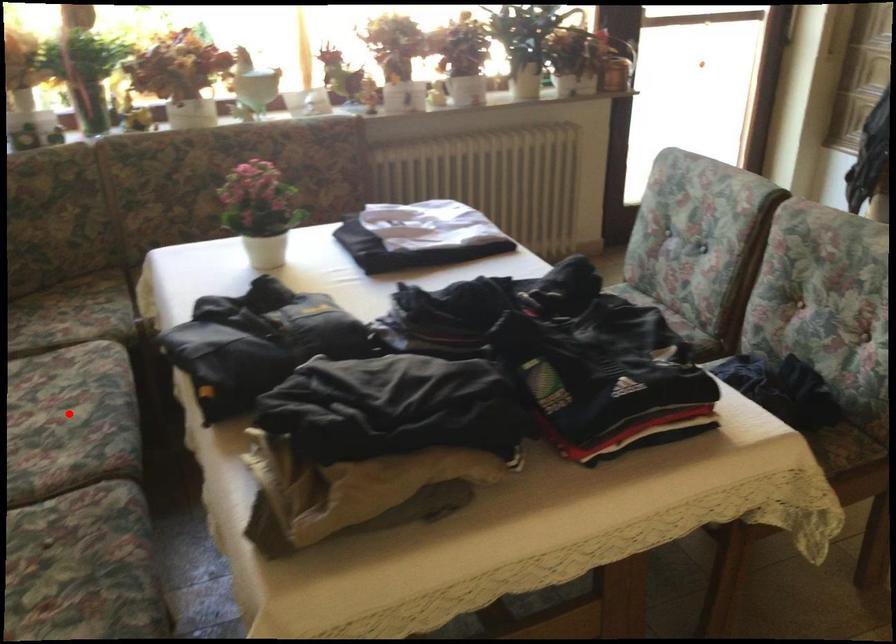
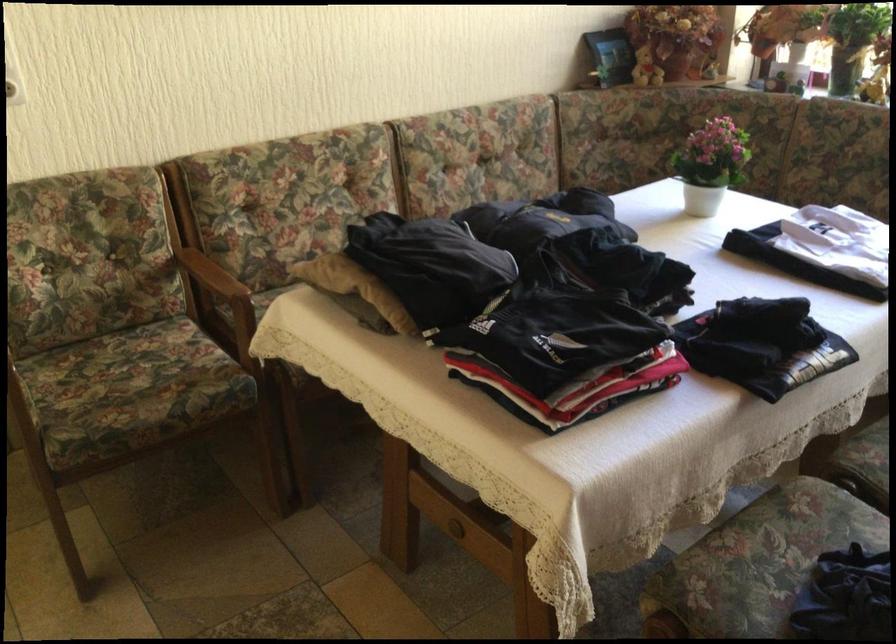
Question: I am providing you with two images of the same scene from different viewpoints. A red point is marked on the first image. Can you still see the location of the red point in image 2?

Choices:
 (A) Yes
 (B) No

Answer: (B)